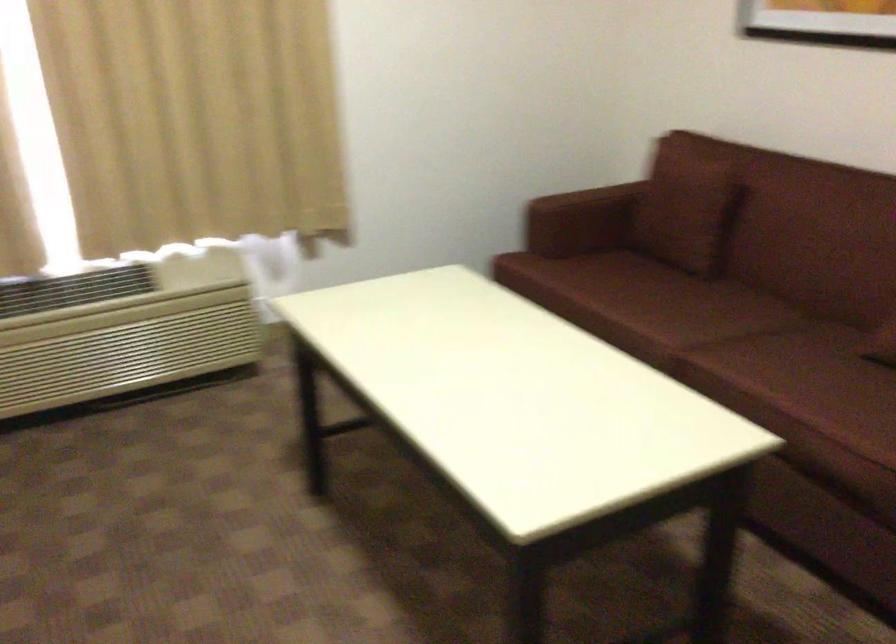
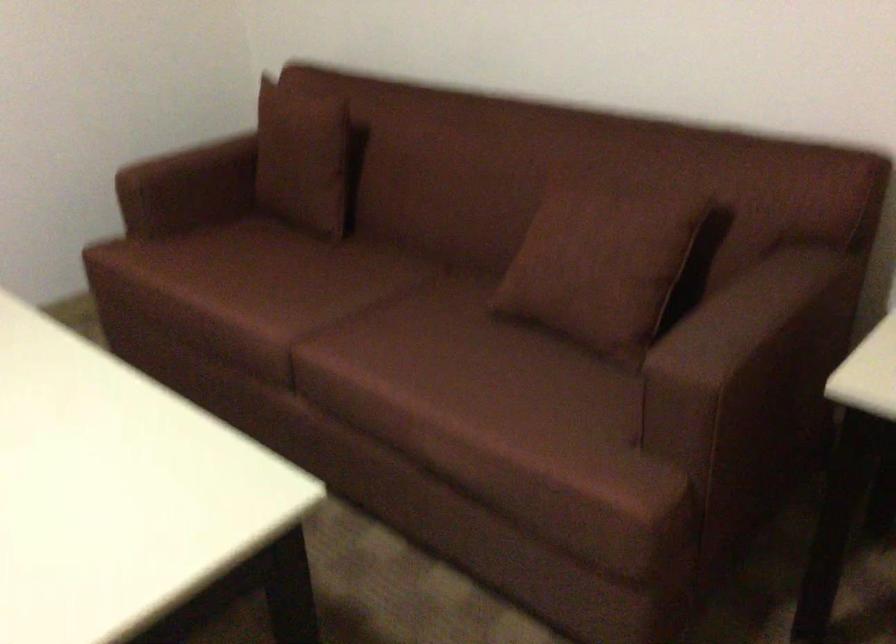
In the second image, find the point that corresponds to point 682,199 in the first image.

(306, 158)